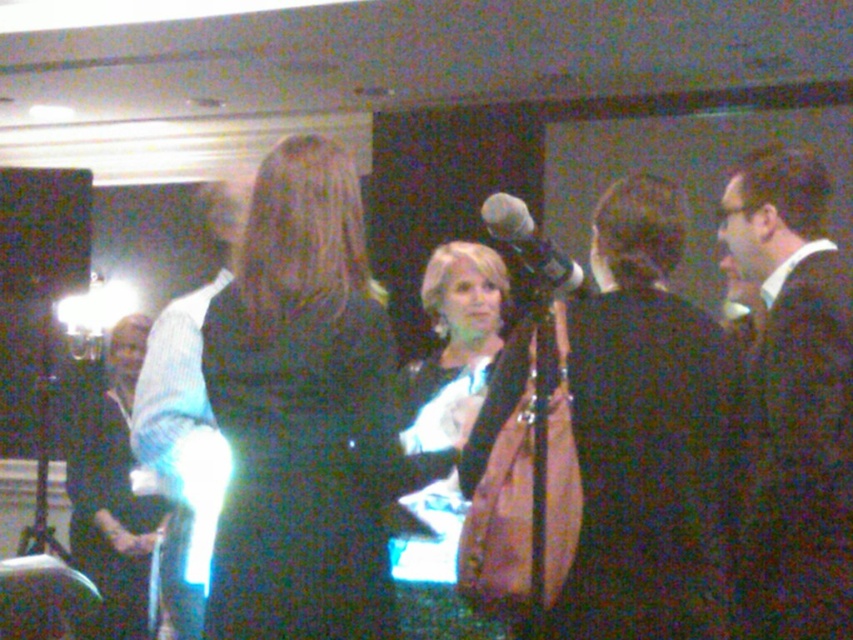
Can you confirm if shiny black dress at center is smaller than blue striped shirt at left?

Yes.

Looking at this image, who is higher up, shiny black dress at center or blue striped shirt at left?

Positioned higher is shiny black dress at center.

Describe the element at coordinates (456, 342) in the screenshot. I see `shiny black dress at center` at that location.

Identify the location of shiny black dress at center. The image size is (853, 640). (456, 342).

Does black fabric suit at center have a smaller size compared to blue striped shirt at left?

Yes, black fabric suit at center is smaller than blue striped shirt at left.

Does black fabric suit at center have a greater height compared to blue striped shirt at left?

No, black fabric suit at center is not taller than blue striped shirt at left.

Describe the element at coordinates (608, 449) in the screenshot. I see `black fabric suit at center` at that location.

This screenshot has height=640, width=853. Find the location of `black fabric suit at center`. black fabric suit at center is located at coordinates (608, 449).

Does black fabric dress at center have a greater height compared to blue striped shirt at left?

No, black fabric dress at center is not taller than blue striped shirt at left.

Does point (281, 276) lie in front of point (189, 348)?

Yes, point (281, 276) is closer to viewer.

This screenshot has height=640, width=853. In order to click on black fabric dress at center in this screenshot , I will do `click(305, 413)`.